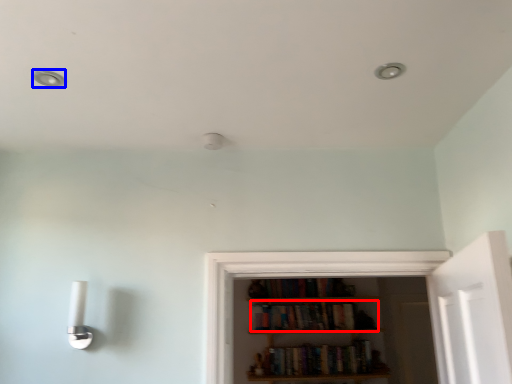
Question: Which point is closer to the camera, book (highlighted by a red box) or dot (highlighted by a blue box)?

Choices:
 (A) book
 (B) dot

Answer: (B)